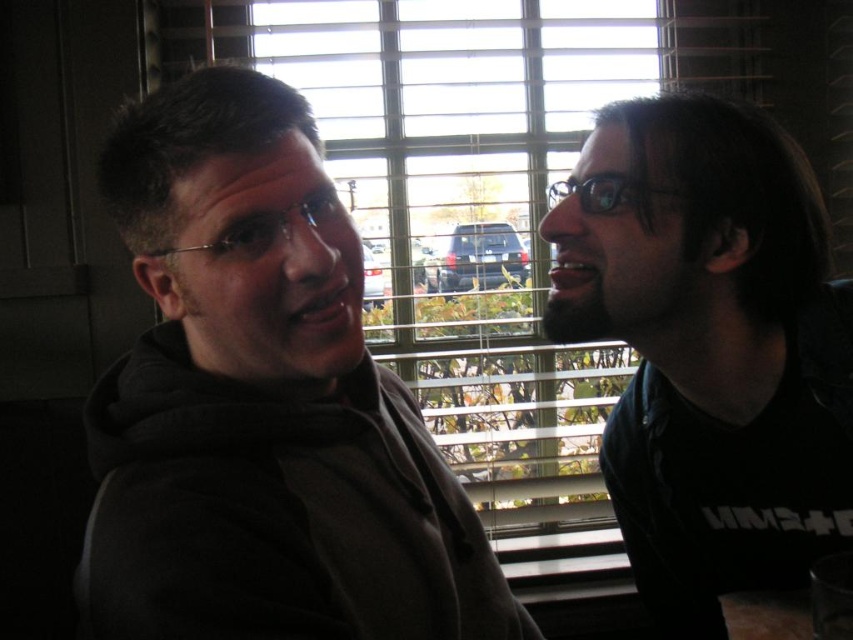
This screenshot has height=640, width=853. What do you see at coordinates (262, 404) in the screenshot?
I see `dark gray hoodie at left` at bounding box center [262, 404].

In the scene shown: Measure the distance between dark gray hoodie at left and camera.

dark gray hoodie at left and camera are 20.55 inches apart.

I want to click on dark gray hoodie at left, so click(x=262, y=404).